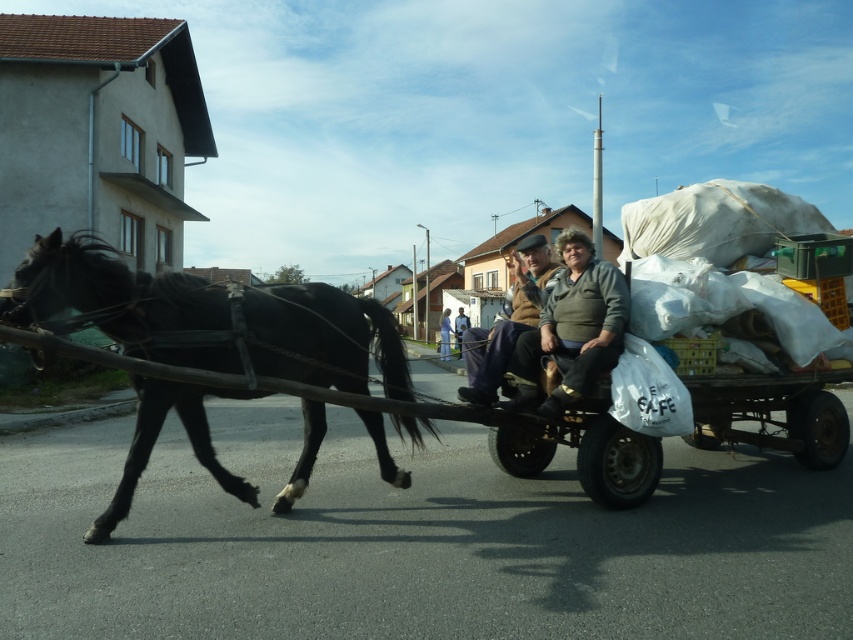
How far apart are black glossy horse at left and light blue fabric at center?

The distance of black glossy horse at left from light blue fabric at center is 25.65 meters.

Who is positioned more to the left, black glossy horse at left or light blue fabric at center?

black glossy horse at left is more to the left.

Who is more distant from viewer, (129, 490) or (440, 339)?

The point (440, 339) is more distant.

Locate an element on the screen. The image size is (853, 640). black glossy horse at left is located at coordinates (207, 317).